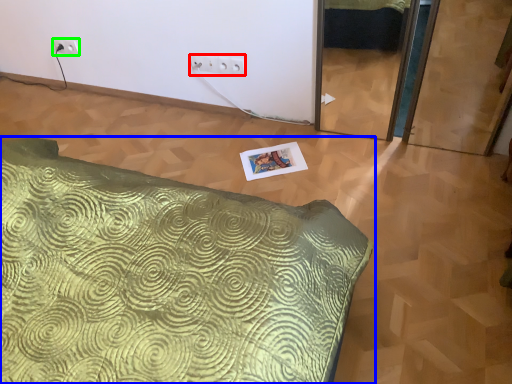
Question: Which object is the farthest from electric outlet (highlighted by a red box)? Choose among these: bed (highlighted by a blue box) or electric outlet (highlighted by a green box).

Choices:
 (A) bed
 (B) electric outlet

Answer: (A)